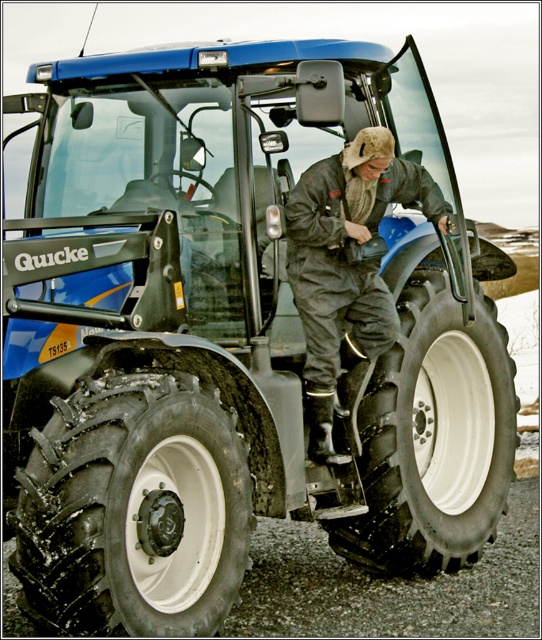
You are standing at the origin point of the image coordinate system. The tractor is at position 0.5, 0.5. You want to walk to the black rubber tire at lower left. Which direction should you move?

The black rubber tire at lower left is located at point (133, 509). Since the tractor is at (271, 320), you should move to the left and down to reach it.